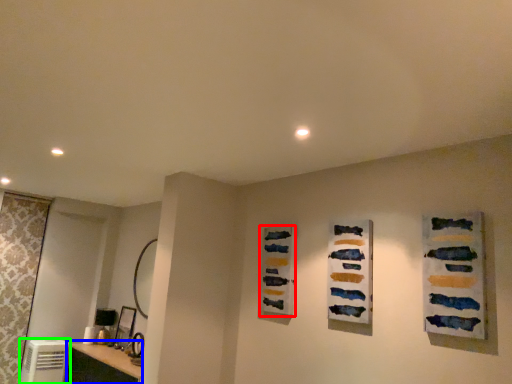
Question: Which object is positioned farthest from art (highlighted by a red box)? Select from vanity (highlighted by a blue box) and appliance (highlighted by a green box).

Choices:
 (A) vanity
 (B) appliance

Answer: (B)